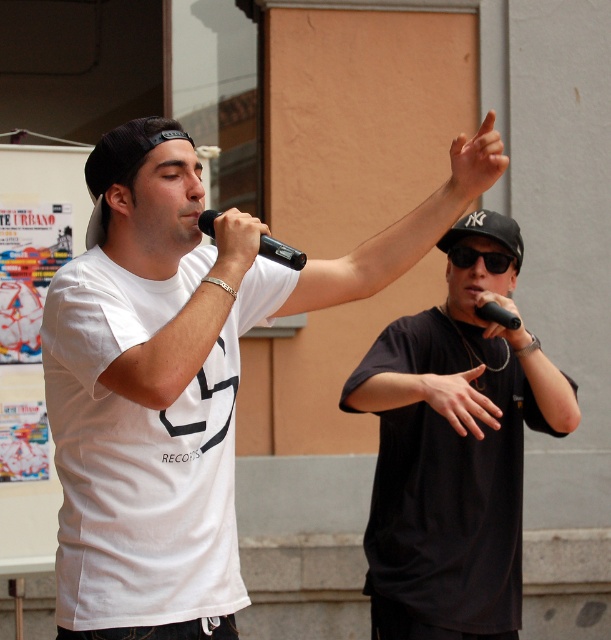
You are a photographer trying to capture a closeup shot of the black matte microphone at right. However, the smooth skin hand at center is blocking your view. Can you adjust your camera angle to see the microphone without moving any objects?

The smooth skin hand at center is in front of the black matte microphone at right, so you can adjust your camera angle by moving it to the left or right to avoid the hand and still capture the microphone.

You are a photographer setting up for a live performance. You need to position a camera so that both the black fabric baseball cap at upper right and the black matte microphone at center are clearly visible in the frame. Based on their positions, which object should be placed on the right side of the camera frame?

The black fabric baseball cap at upper right should be placed on the right side of the camera frame since it is located to the right of the black matte microphone at center.